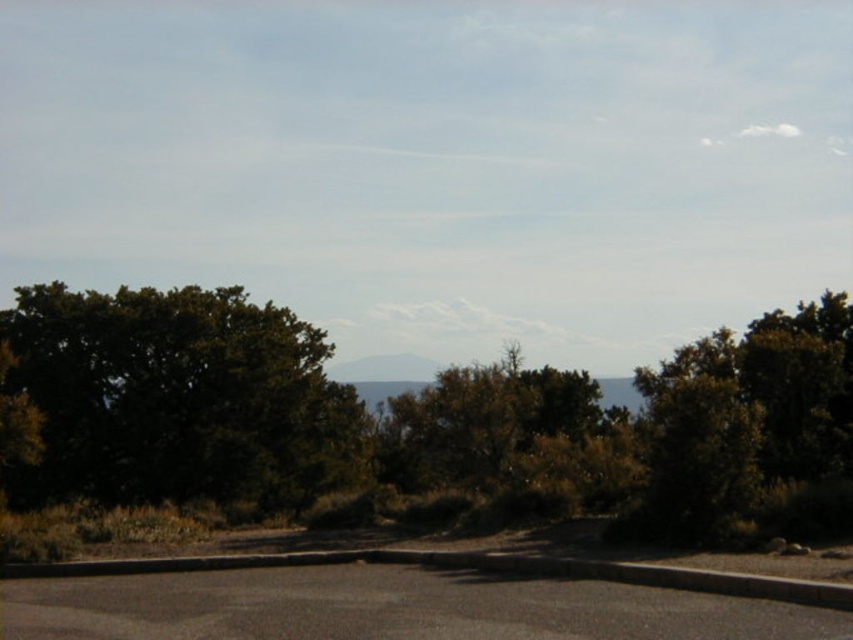
Does green leafy tree at left have a smaller size compared to green leafy tree at center?

Indeed, green leafy tree at left has a smaller size compared to green leafy tree at center.

Is the position of green leafy tree at left less distant than that of green leafy tree at center?

No, green leafy tree at left is further to the viewer.

Does point (358, 476) come behind point (563, 419)?

Yes, it is behind point (563, 419).

Find the location of a particular element. green leafy tree at left is located at coordinates (178, 397).